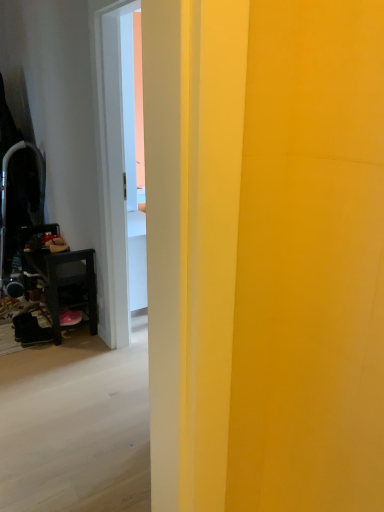
Question: Considering the relative sizes of pink suede shoe at lower left, the 2th footwear from the left, and metallic black swivel chair at left in the image provided, is pink suede shoe at lower left, the 2th footwear from the left, thinner than metallic black swivel chair at left?

Choices:
 (A) yes
 (B) no

Answer: (A)

Question: Is pink suede shoe at lower left, which is counted as the first footwear, starting from the right, wider than metallic black swivel chair at left?

Choices:
 (A) no
 (B) yes

Answer: (A)

Question: Is pink suede shoe at lower left, the 2th footwear from the left, positioned with its back to metallic black swivel chair at left?

Choices:
 (A) yes
 (B) no

Answer: (B)

Question: Considering the relative positions of pink suede shoe at lower left, which is counted as the first footwear, starting from the right, and metallic black swivel chair at left in the image provided, is pink suede shoe at lower left, which is counted as the first footwear, starting from the right, to the left of metallic black swivel chair at left from the viewer's perspective?

Choices:
 (A) no
 (B) yes

Answer: (A)

Question: Is pink suede shoe at lower left, the 2th footwear from the left, shorter than metallic black swivel chair at left?

Choices:
 (A) yes
 (B) no

Answer: (A)

Question: From a real-world perspective, is pink suede shoe at lower left, which is counted as the first footwear, starting from the right, over metallic black swivel chair at left?

Choices:
 (A) yes
 (B) no

Answer: (B)

Question: From the image's perspective, is metallic black swivel chair at left located beneath black suede boot at lower left, the 1th footwear from the left?

Choices:
 (A) yes
 (B) no

Answer: (B)

Question: Is metallic black swivel chair at left behind black suede boot at lower left, which is the second footwear in right-to-left order?

Choices:
 (A) yes
 (B) no

Answer: (A)

Question: Considering the relative sizes of metallic black swivel chair at left and black suede boot at lower left, the 1th footwear from the left, in the image provided, is metallic black swivel chair at left taller than black suede boot at lower left, the 1th footwear from the left,?

Choices:
 (A) no
 (B) yes

Answer: (B)

Question: Is metallic black swivel chair at left completely or partially outside of black suede boot at lower left, which is the second footwear in right-to-left order?

Choices:
 (A) yes
 (B) no

Answer: (A)

Question: Considering the relative positions of metallic black swivel chair at left and black suede boot at lower left, which is the second footwear in right-to-left order, in the image provided, is metallic black swivel chair at left to the right of black suede boot at lower left, which is the second footwear in right-to-left order, from the viewer's perspective?

Choices:
 (A) yes
 (B) no

Answer: (B)

Question: From a real-world perspective, is metallic black swivel chair at left under black suede boot at lower left, which is the second footwear in right-to-left order?

Choices:
 (A) no
 (B) yes

Answer: (A)

Question: From the image's perspective, is pink suede shoe at lower left, the 2th footwear from the left, located beneath wooden dark brown table at left?

Choices:
 (A) yes
 (B) no

Answer: (A)